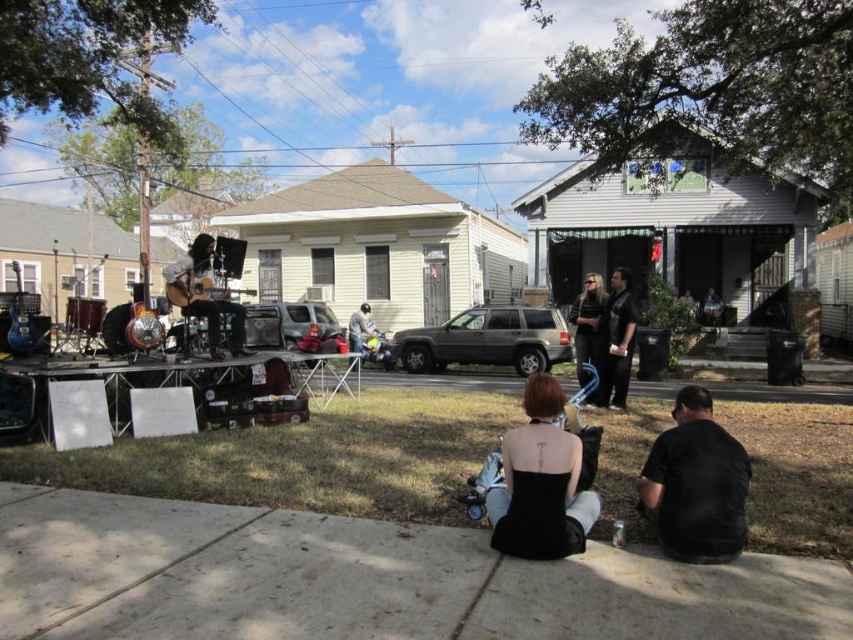
Question: Which of the following is the closest to the observer?

Choices:
 (A) black matte shirt at lower right
 (B) black matte dress at lower center
 (C) black leather jacket at center
 (D) concrete sidewalk at lower center

Answer: (D)

Question: Can you confirm if black matte shirt at lower right is positioned above black leather jacket at center?

Choices:
 (A) no
 (B) yes

Answer: (A)

Question: Does black matte dress at lower center have a greater width compared to black smooth shirt at center?

Choices:
 (A) yes
 (B) no

Answer: (A)

Question: Which point is farther to the camera?

Choices:
 (A) (819, 616)
 (B) (595, 307)
 (C) (741, 518)
 (D) (519, 444)

Answer: (B)

Question: Among these points, which one is farthest from the camera?

Choices:
 (A) (583, 288)
 (B) (544, 378)
 (C) (619, 332)
 (D) (252, 636)

Answer: (A)

Question: Can you confirm if black matte dress at lower center is positioned to the left of black smooth shirt at center?

Choices:
 (A) yes
 (B) no

Answer: (A)